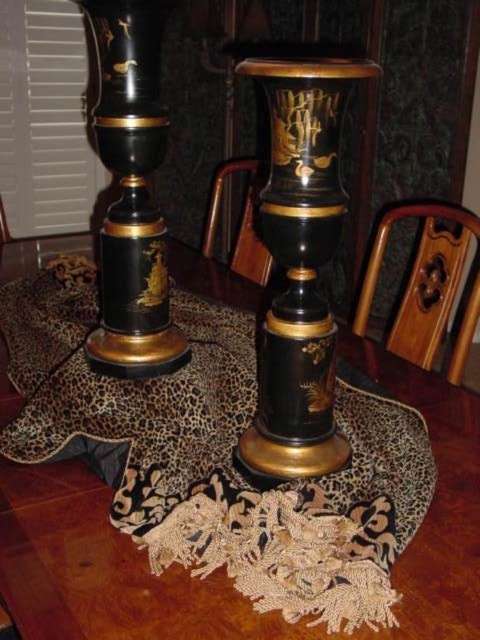
You are arranging flowers in the black lacquer vase at center and need to place it on a shelf that can only hold items placed above the glossy lacquer candle holder at left. Is this possible?

The black lacquer vase at center is located below the glossy lacquer candle holder at left, so placing it on a shelf that requires items to be above the glossy lacquer candle holder at left is not possible.

You are arranging flowers for a special event and have a bouquet that requires a tall vase. You see the black lacquer pedestal at center and the glossy lacquer candle holder at left. Which object is more suitable for holding the bouquet?

The black lacquer pedestal at center is larger in size than the glossy lacquer candle holder at left, making it more suitable for holding a bouquet that requires a tall vase.

You are setting up a table for a formal dinner and need to place a centerpiece between the black lacquer pedestal at center and the black lacquer vase at center. The centerpiece requires a minimum of 40 centimeters of space. Based on the image, will there be enough space between them?

The black lacquer pedestal at center is 33.93 centimeters from the black lacquer vase at center, which is less than the required 40 centimeters. Therefore, there is not enough space for the centerpiece between them.